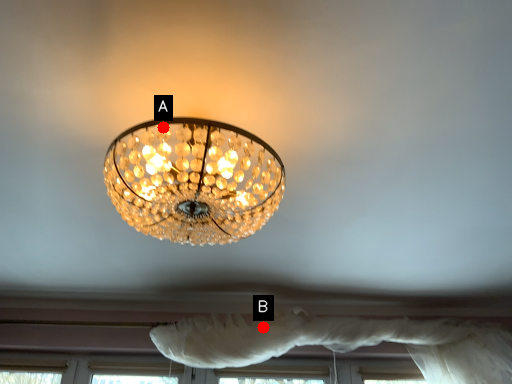
Question: Two points are circled on the image, labeled by A and B beside each circle. Which point is closer to the camera?

Choices:
 (A) A is closer
 (B) B is closer

Answer: (A)